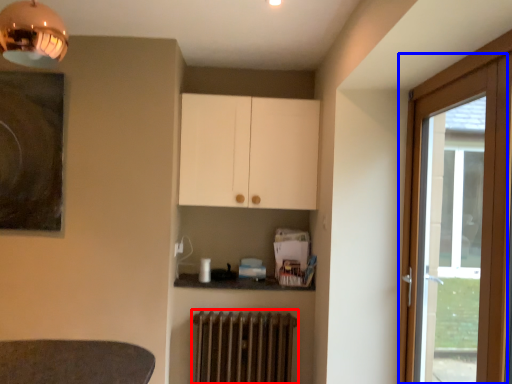
Question: Which of the following is the farthest to the observer, radiator (highlighted by a red box) or door (highlighted by a blue box)?

Choices:
 (A) radiator
 (B) door

Answer: (A)